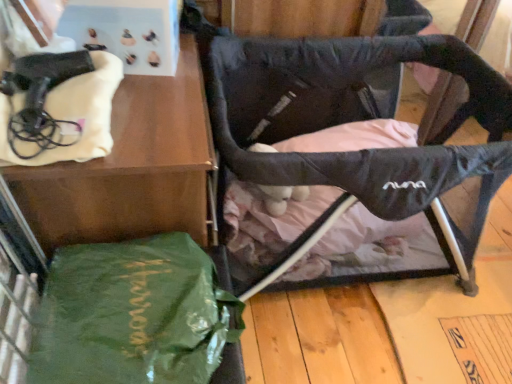
Question: Is black fabric swivel chair at center positioned with its back to green shiny tote bag at lower left?

Choices:
 (A) no
 (B) yes

Answer: (A)

Question: From the image's perspective, is black fabric swivel chair at center over green shiny tote bag at lower left?

Choices:
 (A) yes
 (B) no

Answer: (A)

Question: Considering the relative sizes of black fabric swivel chair at center and green shiny tote bag at lower left in the image provided, is black fabric swivel chair at center thinner than green shiny tote bag at lower left?

Choices:
 (A) no
 (B) yes

Answer: (A)

Question: From a real-world perspective, is black fabric swivel chair at center positioned under green shiny tote bag at lower left based on gravity?

Choices:
 (A) yes
 (B) no

Answer: (A)

Question: Can you confirm if black fabric swivel chair at center is positioned to the right of green shiny tote bag at lower left?

Choices:
 (A) yes
 (B) no

Answer: (A)

Question: Is black fabric swivel chair at center further to camera compared to green shiny tote bag at lower left?

Choices:
 (A) no
 (B) yes

Answer: (B)

Question: Is black fabric swivel chair at center wider than green fabric bag at lower left?

Choices:
 (A) yes
 (B) no

Answer: (A)

Question: Would you say black fabric swivel chair at center contains green fabric bag at lower left?

Choices:
 (A) no
 (B) yes

Answer: (A)

Question: Is black fabric swivel chair at center not close to green fabric bag at lower left?

Choices:
 (A) no
 (B) yes

Answer: (A)

Question: From a real-world perspective, is black fabric swivel chair at center positioned over green fabric bag at lower left based on gravity?

Choices:
 (A) yes
 (B) no

Answer: (B)

Question: Considering the relative positions of black fabric swivel chair at center and green fabric bag at lower left in the image provided, is black fabric swivel chair at center to the right of green fabric bag at lower left from the viewer's perspective?

Choices:
 (A) yes
 (B) no

Answer: (A)

Question: Does black fabric swivel chair at center have a lesser height compared to green fabric bag at lower left?

Choices:
 (A) no
 (B) yes

Answer: (B)

Question: From a real-world perspective, is green fabric bag at lower left physically above black fabric swivel chair at center?

Choices:
 (A) no
 (B) yes

Answer: (B)